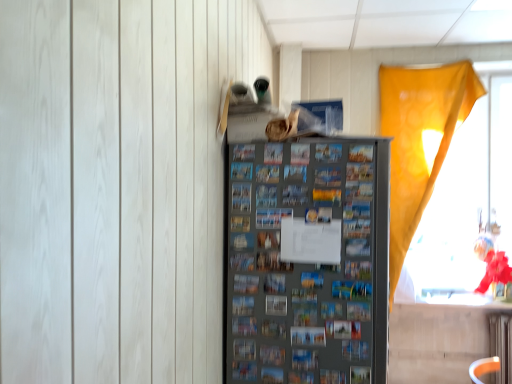
Question: Considering the relative positions of translucent yellow curtain at right and metallic gray fridge at center in the image provided, is translucent yellow curtain at right to the left or to the right of metallic gray fridge at center?

Choices:
 (A) right
 (B) left

Answer: (A)

Question: Considering the positions of translucent yellow curtain at right and metallic gray fridge at center in the image, is translucent yellow curtain at right wider or thinner than metallic gray fridge at center?

Choices:
 (A) wide
 (B) thin

Answer: (B)

Question: Based on their sizes in the image, would you say translucent yellow curtain at right is bigger or smaller than metallic gray fridge at center?

Choices:
 (A) small
 (B) big

Answer: (A)

Question: Considering the positions of metallic gray fridge at center and translucent yellow curtain at right in the image, is metallic gray fridge at center bigger or smaller than translucent yellow curtain at right?

Choices:
 (A) big
 (B) small

Answer: (A)

Question: From a real-world perspective, is metallic gray fridge at center physically located above or below translucent yellow curtain at right?

Choices:
 (A) above
 (B) below

Answer: (B)

Question: Is metallic gray fridge at center in front of or behind translucent yellow curtain at right in the image?

Choices:
 (A) behind
 (B) front

Answer: (B)

Question: Is metallic gray fridge at center spatially inside translucent yellow curtain at right, or outside of it?

Choices:
 (A) inside
 (B) outside

Answer: (B)